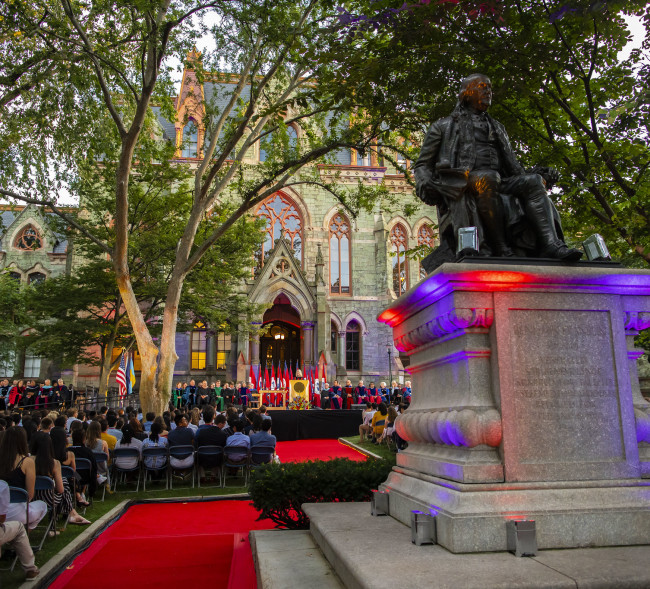
The height and width of the screenshot is (589, 650). Find the location of `1 stage`. 1 stage is located at coordinates (283, 413).